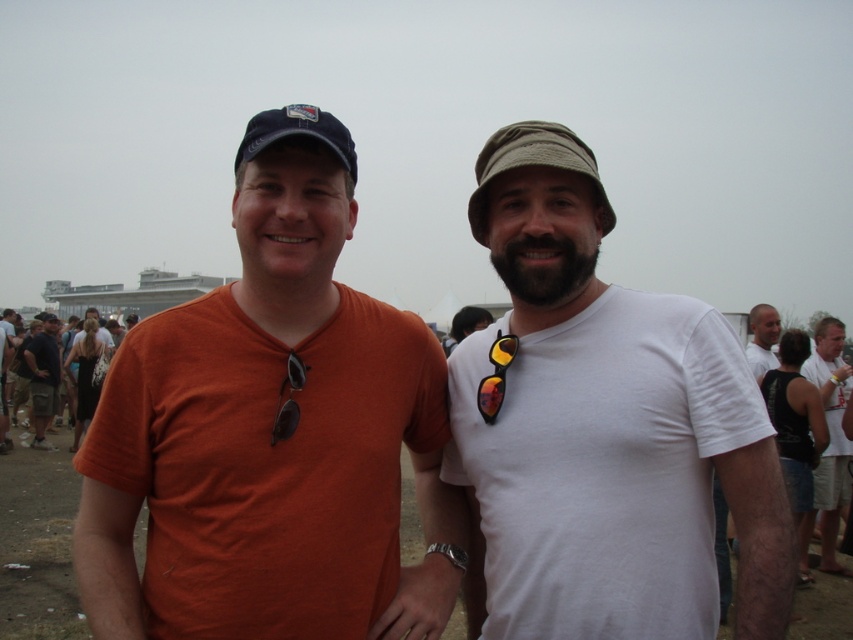
You are a photographer adjusting your camera settings to focus on the black cotton t shirt at right. The camera has a focus point at coordinates point (828, 442). Is the focus point correctly positioned to capture the black cotton t shirt at right?

Yes, the focus point at point (828, 442) is correctly positioned to capture the black cotton t shirt at right because the description states that the point marks the black cotton t shirt at right.

In the scene shown: Please provide the 2D coordinates of the khaki fabric hat at center in the image. The coordinates should be in the format of a tuple with two decimal numbers, such as 0.000 and 1.000 representing the left, right, top, and bottom boundaries respectively.

The 2D coordinates of the khaki fabric hat at center are at point (532, 164).